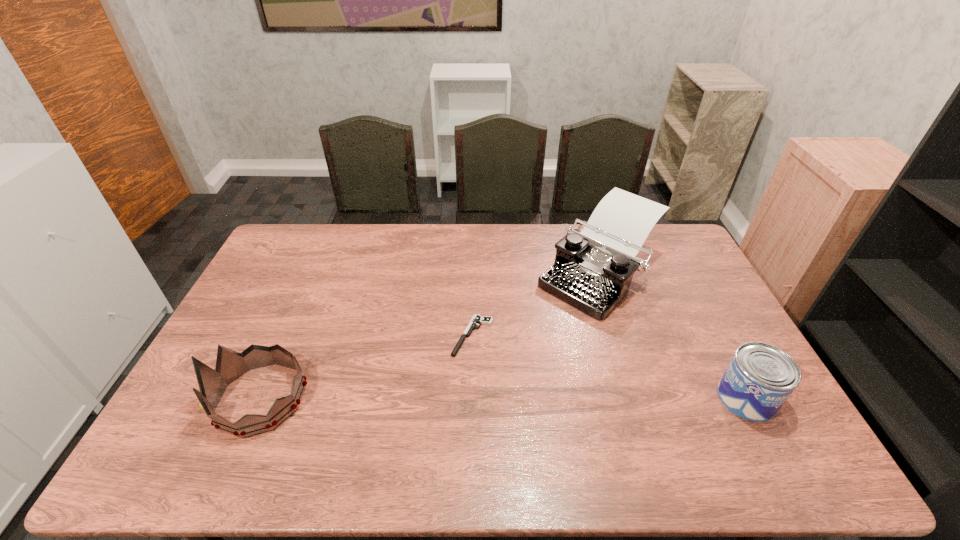
Identify the location of vacant area situated 0.170m on the front-facing side of the pistol. The height and width of the screenshot is (540, 960). (439, 403).

At what (x,y) coordinates should I click in order to perform the action: click on vacant area located 0.230m on the front-facing side of the pistol. Please return your answer as a coordinate pair (x, y). Looking at the image, I should click on (428, 422).

Where is `object positioned at the far edge`? This screenshot has height=540, width=960. object positioned at the far edge is located at coordinates (593, 269).

Where is `tiara that is at the near edge`? tiara that is at the near edge is located at coordinates pos(230,365).

Locate an element on the screen. can positioned at the near edge is located at coordinates (759, 379).

Find the location of a particular element. object that is at the left edge is located at coordinates point(230,365).

Locate an element on the screen. can that is at the right edge is located at coordinates (759, 379).

The image size is (960, 540). What are the coordinates of `typewriter that is at the right edge` in the screenshot? It's located at (593, 269).

The image size is (960, 540). Find the location of `object that is at the near left corner`. object that is at the near left corner is located at coordinates (230, 365).

Locate an element on the screen. This screenshot has height=540, width=960. object that is at the far right corner is located at coordinates (593, 269).